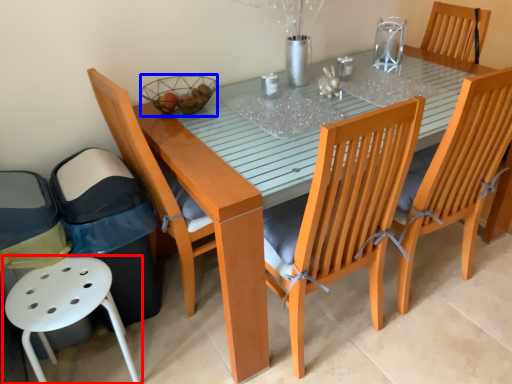
Question: Which object appears farthest to the camera in this image, chair (highlighted by a red box) or basket (highlighted by a blue box)?

Choices:
 (A) chair
 (B) basket

Answer: (B)